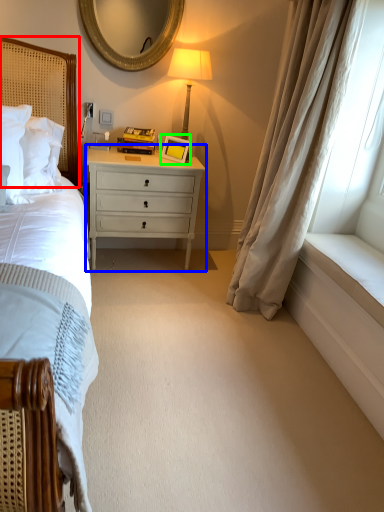
Question: Estimate the real-world distances between objects in this image. Which object is closer to headboard (highlighted by a red box), chest of drawers (highlighted by a blue box) or picture frame (highlighted by a green box)?

Choices:
 (A) chest of drawers
 (B) picture frame

Answer: (A)